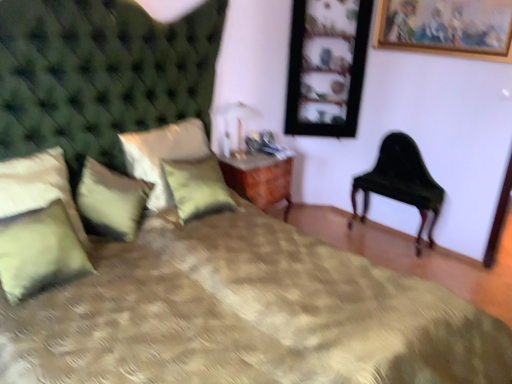
The width and height of the screenshot is (512, 384). Describe the element at coordinates (234, 127) in the screenshot. I see `metallic gold table lamp at upper center` at that location.

Measure the distance between green textured pillow at center, arranged as the 1th pillow when viewed from the right, and camera.

The distance of green textured pillow at center, arranged as the 1th pillow when viewed from the right, from camera is 2.52 meters.

The image size is (512, 384). What are the coordinates of `green textured pillow at center, the 5th pillow when ordered from left to right` in the screenshot? It's located at (197, 187).

Image resolution: width=512 pixels, height=384 pixels. What do you see at coordinates (259, 179) in the screenshot?
I see `wooden nightstand at center` at bounding box center [259, 179].

This screenshot has width=512, height=384. What are the coordinates of `wooden nightstand at center` in the screenshot? It's located at (259, 179).

At what (x,y) coordinates should I click in order to perform the action: click on green velvet chair at right. Please return your answer as a coordinate pair (x, y). Looking at the image, I should click on (401, 182).

The image size is (512, 384). What do you see at coordinates (110, 201) in the screenshot? I see `green velvet pillow at left, the third pillow positioned from the left` at bounding box center [110, 201].

What do you see at coordinates (39, 251) in the screenshot?
I see `green velvet pillow at lower left, which is counted as the second pillow, starting from the left` at bounding box center [39, 251].

Find the location of a particular element. The width and height of the screenshot is (512, 384). metallic gold table lamp at upper center is located at coordinates (234, 127).

Would you say soft green fabric pillow at left, the fifth pillow when ordered from right to left, is outside green velvet pillow at lower left, which is counted as the second pillow, starting from the left?

Yes, soft green fabric pillow at left, the fifth pillow when ordered from right to left, is not within green velvet pillow at lower left, which is counted as the second pillow, starting from the left.

Based on their sizes in the image, would you say soft green fabric pillow at left, arranged as the first pillow when viewed from the left, is bigger or smaller than green velvet pillow at lower left, which is counted as the second pillow, starting from the left?

soft green fabric pillow at left, arranged as the first pillow when viewed from the left, is bigger than green velvet pillow at lower left, which is counted as the second pillow, starting from the left.

What's the angular difference between soft green fabric pillow at left, the fifth pillow when ordered from right to left, and green velvet pillow at lower left, the fourth pillow when ordered from right to left,'s facing directions?

0.000576 degrees separate the facing orientations of soft green fabric pillow at left, the fifth pillow when ordered from right to left, and green velvet pillow at lower left, the fourth pillow when ordered from right to left.

From the image's perspective, is soft green fabric pillow at left, the fifth pillow when ordered from right to left, on green velvet pillow at lower left, which is counted as the second pillow, starting from the left?

Indeed, from the image's perspective, soft green fabric pillow at left, the fifth pillow when ordered from right to left, is shown above green velvet pillow at lower left, which is counted as the second pillow, starting from the left.

Considering the sizes of objects green velvet chair at right and green velvet pillow at lower left, which is counted as the second pillow, starting from the left, in the image provided, who is bigger, green velvet chair at right or green velvet pillow at lower left, which is counted as the second pillow, starting from the left,?

Bigger between the two is green velvet chair at right.

Looking at this image, does green velvet chair at right come in front of green velvet pillow at lower left, which is counted as the second pillow, starting from the left?

That is False.

Is point (368, 177) positioned after point (63, 248)?

Yes, it is behind point (63, 248).

Consider the image. From the image's perspective, which object appears higher, green velvet chair at right or green velvet pillow at lower left, which is counted as the second pillow, starting from the left?

green velvet chair at right, from the image's perspective.

Which object is further away from the camera taking this photo, wooden nightstand at center or gold-framed picture at upper right, the 1th picture frame from the right?

wooden nightstand at center is more distant.

Is wooden nightstand at center looking in the opposite direction of gold-framed picture at upper right, the 1th picture frame from the right?

wooden nightstand at center is not turned away from gold-framed picture at upper right, the 1th picture frame from the right.

Which object is thinner, wooden nightstand at center or gold-framed picture at upper right, the 1th picture frame from the right?

Thinner between the two is gold-framed picture at upper right, the 1th picture frame from the right.

Considering the sizes of objects green textured pillow at center, the 5th pillow when ordered from left to right, and gold-framed picture at upper right, the 1th picture frame from the right, in the image provided, who is shorter, green textured pillow at center, the 5th pillow when ordered from left to right, or gold-framed picture at upper right, the 1th picture frame from the right,?

gold-framed picture at upper right, the 1th picture frame from the right, is shorter.

Where is `the 1st picture frame behind the green textured pillow at center, the 5th pillow when ordered from left to right, starting your count from the anchor`? Image resolution: width=512 pixels, height=384 pixels. the 1st picture frame behind the green textured pillow at center, the 5th pillow when ordered from left to right, starting your count from the anchor is located at coordinates (446, 27).

Is point (193, 206) more distant than point (462, 53)?

No, it is in front of (462, 53).

Looking at this image, how different are the orientations of green textured pillow at center, the 5th pillow when ordered from left to right, and gold-framed picture at upper right, the second picture frame when ordered from left to right, in degrees?

There is a 92.2-degree angle between the facing directions of green textured pillow at center, the 5th pillow when ordered from left to right, and gold-framed picture at upper right, the second picture frame when ordered from left to right.

Consider the image. Does green textured pillow at center, which appears as the second pillow when viewed from the right, touch soft green fabric pillow at left, arranged as the first pillow when viewed from the left?

There is a gap between green textured pillow at center, which appears as the second pillow when viewed from the right, and soft green fabric pillow at left, arranged as the first pillow when viewed from the left.

Considering the relative sizes of green textured pillow at center, placed as the 4th pillow when sorted from left to right, and soft green fabric pillow at left, the fifth pillow when ordered from right to left, in the image provided, is green textured pillow at center, placed as the 4th pillow when sorted from left to right, thinner than soft green fabric pillow at left, the fifth pillow when ordered from right to left,?

In fact, green textured pillow at center, placed as the 4th pillow when sorted from left to right, might be wider than soft green fabric pillow at left, the fifth pillow when ordered from right to left.

In terms of size, does green textured pillow at center, which appears as the second pillow when viewed from the right, appear bigger or smaller than soft green fabric pillow at left, the fifth pillow when ordered from right to left?

In the image, green textured pillow at center, which appears as the second pillow when viewed from the right, appears to be larger than soft green fabric pillow at left, the fifth pillow when ordered from right to left.

Is point (144, 145) farther from viewer compared to point (2, 214)?

Yes, it is behind point (2, 214).

Which object is closer to the camera, green velvet pillow at lower left, which is counted as the second pillow, starting from the left, or green textured pillow at center, arranged as the 1th pillow when viewed from the right?

green velvet pillow at lower left, which is counted as the second pillow, starting from the left, is more forward.

Is green velvet pillow at lower left, which is counted as the second pillow, starting from the left, bigger than green textured pillow at center, arranged as the 1th pillow when viewed from the right?

No.

Is green velvet pillow at lower left, which is counted as the second pillow, starting from the left, spatially inside green textured pillow at center, the 5th pillow when ordered from left to right, or outside of it?

green velvet pillow at lower left, which is counted as the second pillow, starting from the left, is outside green textured pillow at center, the 5th pillow when ordered from left to right.

From the image's perspective, who appears lower, green velvet pillow at lower left, the fourth pillow when ordered from right to left, or green textured pillow at center, the 5th pillow when ordered from left to right?

From the image's view, green velvet pillow at lower left, the fourth pillow when ordered from right to left, is below.

Can you confirm if soft green fabric pillow at left, the fifth pillow when ordered from right to left, is positioned to the left of green velvet pillow at left, which is the third pillow from right to left?

Correct, you'll find soft green fabric pillow at left, the fifth pillow when ordered from right to left, to the left of green velvet pillow at left, which is the third pillow from right to left.

Is point (8, 175) behind point (135, 224)?

No.

Does soft green fabric pillow at left, the fifth pillow when ordered from right to left, have a greater height compared to green velvet pillow at left, which is the third pillow from right to left?

Yes, soft green fabric pillow at left, the fifth pillow when ordered from right to left, is taller than green velvet pillow at left, which is the third pillow from right to left.

Choose the correct answer: Is soft green fabric pillow at left, arranged as the first pillow when viewed from the left, inside green velvet pillow at left, which is the third pillow from right to left, or outside it?

soft green fabric pillow at left, arranged as the first pillow when viewed from the left, exists outside the volume of green velvet pillow at left, which is the third pillow from right to left.

The image size is (512, 384). I want to click on pillow in front of the soft green fabric pillow at left, the fifth pillow when ordered from right to left, so click(x=39, y=251).

There is a green velvet chair at right. Identify the location of the 3rd pillow below it (from the image's perspective). This screenshot has width=512, height=384. (39, 251).

Which object lies nearer to the anchor point green textured pillow at center, which appears as the second pillow when viewed from the right, soft green fabric pillow at left, the fifth pillow when ordered from right to left, or gold-framed picture at upper right, the 1th picture frame from the right?

soft green fabric pillow at left, the fifth pillow when ordered from right to left, is positioned closer to the anchor green textured pillow at center, which appears as the second pillow when viewed from the right.

From the image, which object appears to be nearer to wooden picture frame at upper right, the 2th picture frame in the right-to-left sequence, gold-framed picture at upper right, the 1th picture frame from the right, or green textured pillow at center, the 5th pillow when ordered from left to right?

gold-framed picture at upper right, the 1th picture frame from the right, is positioned closer to the anchor wooden picture frame at upper right, the 2th picture frame in the right-to-left sequence.

Looking at the image, which one is located further to soft green fabric pillow at left, the fifth pillow when ordered from right to left, green velvet pillow at left, which is the third pillow from right to left, or green textured pillow at center, the 5th pillow when ordered from left to right?

The object further to soft green fabric pillow at left, the fifth pillow when ordered from right to left, is green textured pillow at center, the 5th pillow when ordered from left to right.

From the image, which object appears to be farther from wooden picture frame at upper right, the 2th picture frame in the right-to-left sequence, soft green fabric pillow at left, arranged as the first pillow when viewed from the left, or gold-framed picture at upper right, the second picture frame in the back-to-front sequence?

soft green fabric pillow at left, arranged as the first pillow when viewed from the left, lies further to wooden picture frame at upper right, the 2th picture frame in the right-to-left sequence, than the other object.

When comparing their distances from green velvet pillow at lower left, which is counted as the second pillow, starting from the left, does wooden nightstand at center or metallic gold table lamp at upper center seem closer?

Based on the image, wooden nightstand at center appears to be nearer to green velvet pillow at lower left, which is counted as the second pillow, starting from the left.

Which object lies further to the anchor point green textured pillow at center, placed as the 4th pillow when sorted from left to right, green velvet chair at right or soft green fabric pillow at left, the fifth pillow when ordered from right to left?

green velvet chair at right is positioned further to the anchor green textured pillow at center, placed as the 4th pillow when sorted from left to right.

When comparing their distances from wooden nightstand at center, does green velvet pillow at lower left, the fourth pillow when ordered from right to left, or wooden picture frame at upper right, the 2th picture frame in the right-to-left sequence, seem further?

Based on the image, green velvet pillow at lower left, the fourth pillow when ordered from right to left, appears to be further to wooden nightstand at center.

Considering their positions, is green textured pillow at center, the 5th pillow when ordered from left to right, positioned further to wooden picture frame at upper right, placed as the 1th picture frame when sorted from left to right, than metallic gold table lamp at upper center?

green textured pillow at center, the 5th pillow when ordered from left to right.

Find the location of `table lamp between green velvet pillow at lower left, the fourth pillow when ordered from right to left, and wooden picture frame at upper right, the 2th picture frame positioned from the front, along the z-axis`. table lamp between green velvet pillow at lower left, the fourth pillow when ordered from right to left, and wooden picture frame at upper right, the 2th picture frame positioned from the front, along the z-axis is located at coordinates (234, 127).

Identify the location of nightstand located between green textured pillow at center, arranged as the 1th pillow when viewed from the right, and green velvet chair at right in the left-right direction. The width and height of the screenshot is (512, 384). (259, 179).

You are a GUI agent. You are given a task and a screenshot of the screen. Output one action in this format:
    pyautogui.click(x=<x>, y=<y>)
    Task: Click on the chair between wooden nightstand at center and gold-framed picture at upper right, placed as the first picture frame when sorted from front to back, from left to right
    Image resolution: width=512 pixels, height=384 pixels.
    Given the screenshot: What is the action you would take?
    pyautogui.click(x=401, y=182)

The image size is (512, 384). I want to click on table lamp situated between soft green fabric pillow at left, arranged as the first pillow when viewed from the left, and gold-framed picture at upper right, placed as the first picture frame when sorted from front to back, from left to right, so 234,127.